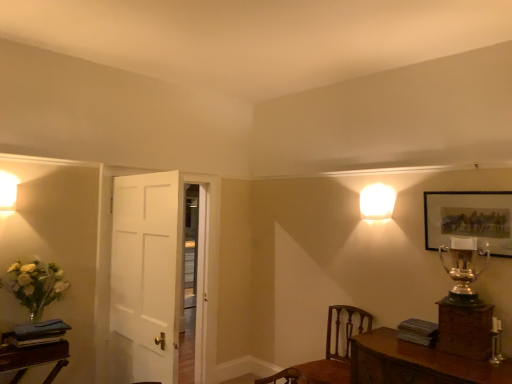
Question: Does matte gold picture frame at upper right have a larger size compared to white glossy square at upper right, which is the first lamp from right to left?

Choices:
 (A) no
 (B) yes

Answer: (B)

Question: From a real-world perspective, is matte gold picture frame at upper right located beneath white glossy square at upper right, which is counted as the 2th lamp, starting from the front?

Choices:
 (A) yes
 (B) no

Answer: (A)

Question: Is matte gold picture frame at upper right shorter than white glossy square at upper right, which is counted as the 2th lamp, starting from the front?

Choices:
 (A) yes
 (B) no

Answer: (B)

Question: Is matte gold picture frame at upper right located outside white glossy square at upper right, acting as the 1th lamp starting from the back?

Choices:
 (A) yes
 (B) no

Answer: (A)

Question: From a real-world perspective, is matte gold picture frame at upper right positioned over white glossy square at upper right, which is the first lamp from right to left, based on gravity?

Choices:
 (A) no
 (B) yes

Answer: (A)

Question: Visually, is gold metallic trophy at upper right positioned to the left or to the right of white wooden door at center?

Choices:
 (A) right
 (B) left

Answer: (A)

Question: From the image's perspective, relative to white wooden door at center, is gold metallic trophy at upper right above or below?

Choices:
 (A) above
 (B) below

Answer: (A)

Question: Looking at the image, does gold metallic trophy at upper right seem bigger or smaller compared to white wooden door at center?

Choices:
 (A) small
 (B) big

Answer: (A)

Question: Is point (462, 284) closer or farther from the camera than point (212, 218)?

Choices:
 (A) closer
 (B) farther

Answer: (A)

Question: In the image, is white glossy square at upper right, acting as the 1th lamp starting from the back, on the left side or the right side of white wooden door at center?

Choices:
 (A) right
 (B) left

Answer: (A)

Question: Considering their positions, is white glossy square at upper right, which is the first lamp from right to left, located in front of or behind white wooden door at center?

Choices:
 (A) behind
 (B) front

Answer: (B)

Question: Considering the positions of white glossy square at upper right, which is the first lamp from right to left, and white wooden door at center in the image, is white glossy square at upper right, which is the first lamp from right to left, taller or shorter than white wooden door at center?

Choices:
 (A) short
 (B) tall

Answer: (A)

Question: From a real-world perspective, is white glossy square at upper right, acting as the 1th lamp starting from the back, physically located above or below white wooden door at center?

Choices:
 (A) below
 (B) above

Answer: (B)

Question: Considering their positions, is gold metallic trophy at upper right located in front of or behind wooden table at lower right?

Choices:
 (A) behind
 (B) front

Answer: (A)

Question: In the image, is gold metallic trophy at upper right on the left side or the right side of wooden table at lower right?

Choices:
 (A) left
 (B) right

Answer: (B)